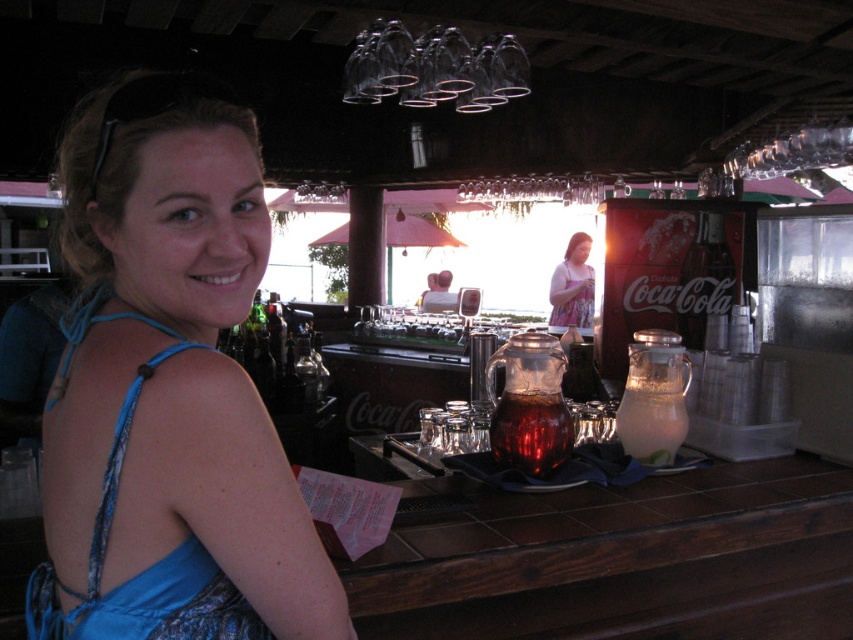
Who is shorter, blue satin dress at left or translucent glass pitcher at center?

translucent glass pitcher at center is shorter.

Locate an element on the screen. The image size is (853, 640). blue satin dress at left is located at coordinates (148, 566).

The image size is (853, 640). Find the location of `blue satin dress at left`. blue satin dress at left is located at coordinates (148, 566).

Who is more forward, (137, 616) or (641, 456)?

Point (137, 616) is more forward.

Which is above, blue satin dress at left or clear glass pitcher at center?

clear glass pitcher at center

The height and width of the screenshot is (640, 853). I want to click on blue satin dress at left, so click(148, 566).

Where is `blue satin dress at left`? blue satin dress at left is located at coordinates (148, 566).

Is translucent glass pitcher at center positioned in front of pink floral dress at center?

Yes, translucent glass pitcher at center is closer to the viewer.

In the scene shown: Between translucent glass pitcher at center and pink floral dress at center, which one appears on the right side from the viewer's perspective?

pink floral dress at center

Is point (498, 422) positioned in front of point (579, 259)?

That is True.

At what (x,y) coordinates should I click in order to perform the action: click on translucent glass pitcher at center. Please return your answer as a coordinate pair (x, y). This screenshot has width=853, height=640. Looking at the image, I should click on (529, 404).